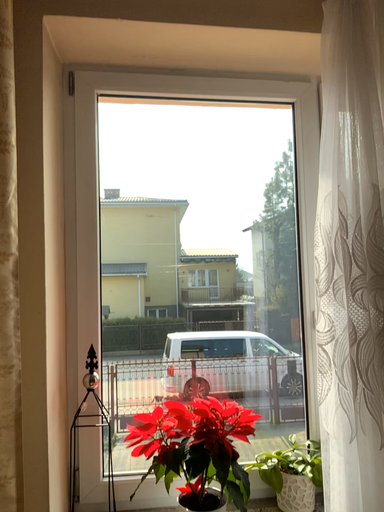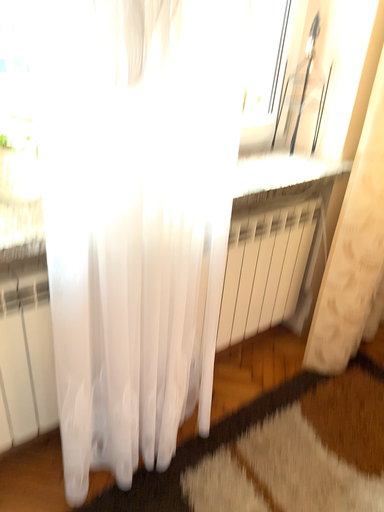
Question: Which way did the camera rotate in the video?

Choices:
 (A) rotated left
 (B) rotated right

Answer: (B)